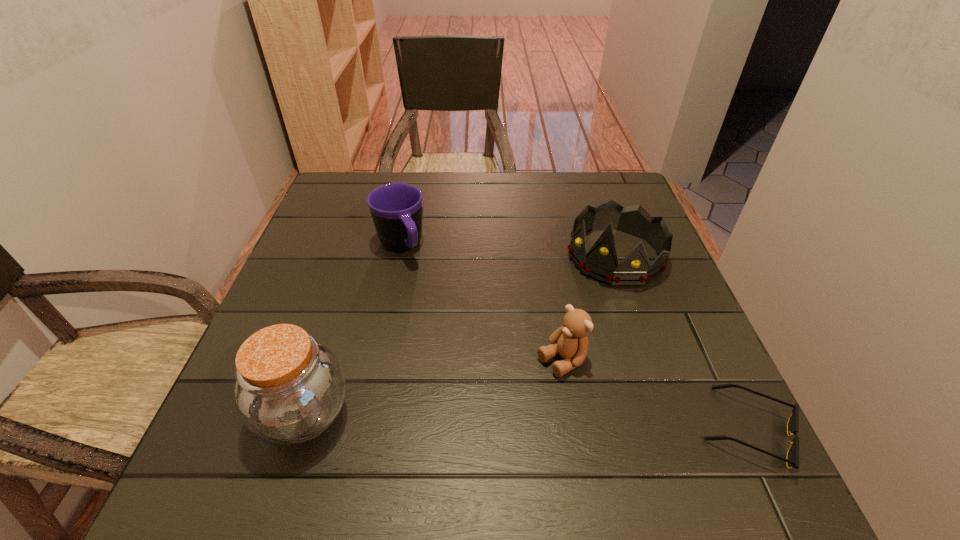
Locate an element on the screen. The width and height of the screenshot is (960, 540). unoccupied area between the third object from right to left and the sunglasses is located at coordinates (655, 395).

This screenshot has height=540, width=960. In order to click on vacant area that lies between the mug and the third object from left to right in this screenshot , I will do `click(481, 304)`.

What are the coordinates of `free space between the tiara and the mug` in the screenshot? It's located at (508, 251).

Where is `free spot between the tiara and the shortest object`? This screenshot has height=540, width=960. free spot between the tiara and the shortest object is located at coordinates (682, 343).

Locate which object ranks third in proximity to the mug. Please provide its 2D coordinates. Your answer should be formatted as a tuple, i.e. [(x, y)], where the tuple contains the x and y coordinates of a point satisfying the conditions above.

[(600, 263)]

Choose which object is the nearest neighbor to the tiara. Please provide its 2D coordinates. Your answer should be formatted as a tuple, i.e. [(x, y)], where the tuple contains the x and y coordinates of a point satisfying the conditions above.

[(570, 341)]

Image resolution: width=960 pixels, height=540 pixels. In order to click on free location that satisfies the following two spatial constraints: 1. on the front side of the third object from right to left; 2. on the lenses of the shortest object in this screenshot , I will do `click(572, 430)`.

Locate an element on the screen. free space that satisfies the following two spatial constraints: 1. on the front side of the shortest object; 2. on the lenses of the jar is located at coordinates (300, 430).

Where is `blank area in the image that satisfies the following two spatial constraints: 1. on the front side of the sunglasses; 2. on the lenses of the mug`? blank area in the image that satisfies the following two spatial constraints: 1. on the front side of the sunglasses; 2. on the lenses of the mug is located at coordinates (362, 430).